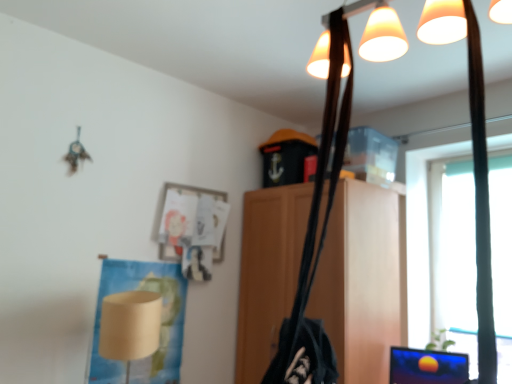
Question: Is wooden cabinet at center in front of or behind beige paper lampshade at lower left in the image?

Choices:
 (A) behind
 (B) front

Answer: (A)

Question: In terms of width, does wooden cabinet at center look wider or thinner when compared to beige paper lampshade at lower left?

Choices:
 (A) wide
 (B) thin

Answer: (A)

Question: Which is farther from the wooden cabinet at center?

Choices:
 (A) transparent plastic window screen at right
 (B) beige paper lampshade at lower left

Answer: (B)

Question: Which is farther from the beige paper lampshade at lower left?

Choices:
 (A) wooden cabinet at center
 (B) transparent plastic window screen at right

Answer: (B)